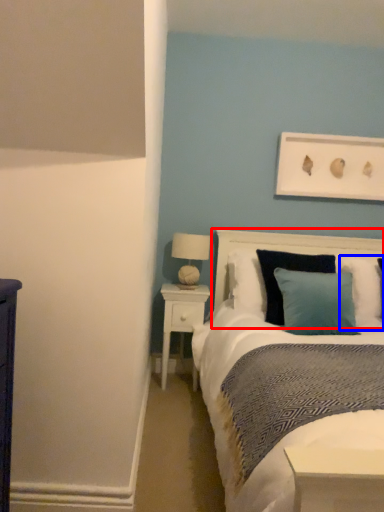
Question: Among these objects, which one is nearest to the camera, headboard (highlighted by a red box) or pillow (highlighted by a blue box)?

Choices:
 (A) headboard
 (B) pillow

Answer: (A)